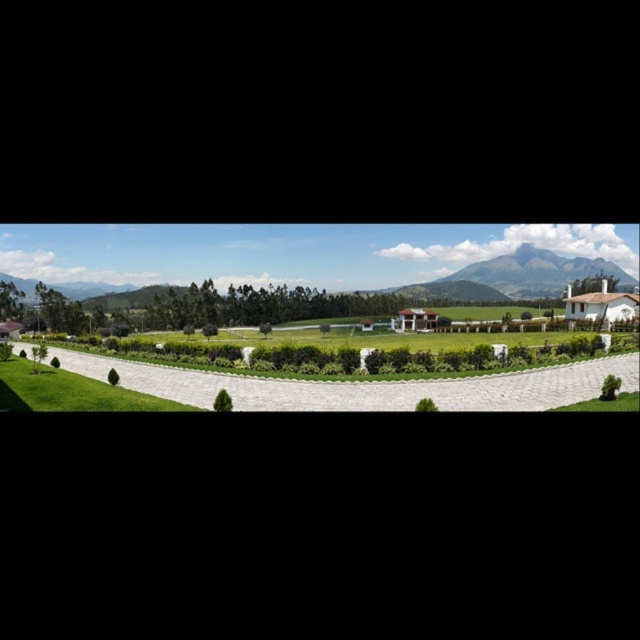
Question: Does rugged stone mountain at upper center have a lesser width compared to green grass at center?

Choices:
 (A) no
 (B) yes

Answer: (A)

Question: Estimate the real-world distances between objects in this image. Which object is closer to the green grass at center?

Choices:
 (A) rugged brown mountain at center
 (B) rugged stone mountain at upper center

Answer: (B)

Question: Considering the relative positions of rugged stone mountain at upper center and green grass at center in the image provided, where is rugged stone mountain at upper center located with respect to green grass at center?

Choices:
 (A) left
 (B) right

Answer: (B)

Question: Among these objects, which one is nearest to the camera?

Choices:
 (A) rugged brown mountain at center
 (B) green grass at center

Answer: (B)

Question: Which of the following is the farthest from the observer?

Choices:
 (A) green grass at center
 (B) rugged brown mountain at center

Answer: (B)

Question: Does rugged stone mountain at upper center appear under rugged brown mountain at center?

Choices:
 (A) no
 (B) yes

Answer: (A)